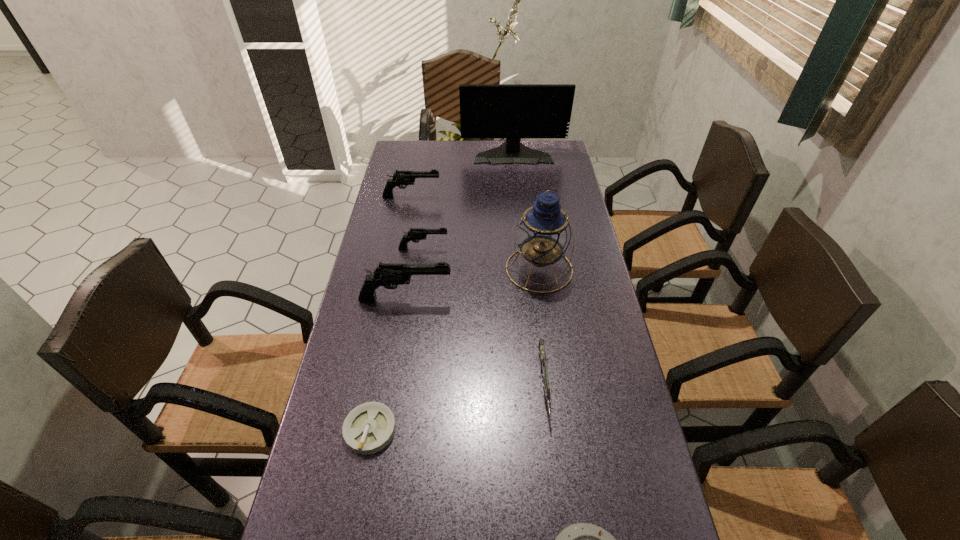
I want to click on ashtray positioned at the left edge, so click(368, 428).

The height and width of the screenshot is (540, 960). Identify the location of monitor that is at the right edge. (513, 111).

Identify the location of lantern positioned at the right edge. (543, 234).

The height and width of the screenshot is (540, 960). I want to click on object at the far right corner, so click(513, 111).

Find the location of a particular element. This screenshot has width=960, height=540. vacant space at the far edge of the desktop is located at coordinates 463,161.

The image size is (960, 540). I want to click on vacant space at the left edge of the desktop, so click(402, 202).

Locate an element on the screen. The height and width of the screenshot is (540, 960). vacant area at the right edge is located at coordinates (572, 201).

The image size is (960, 540). In order to click on vacant space at the far left corner of the desktop in this screenshot , I will do `click(405, 153)`.

The image size is (960, 540). In order to click on vacant space that's between the grey gun and the third tallest object in this screenshot , I will do `click(475, 342)`.

The height and width of the screenshot is (540, 960). What are the coordinates of `blank region between the second farthest black gun and the rightmost gun` in the screenshot? It's located at (484, 318).